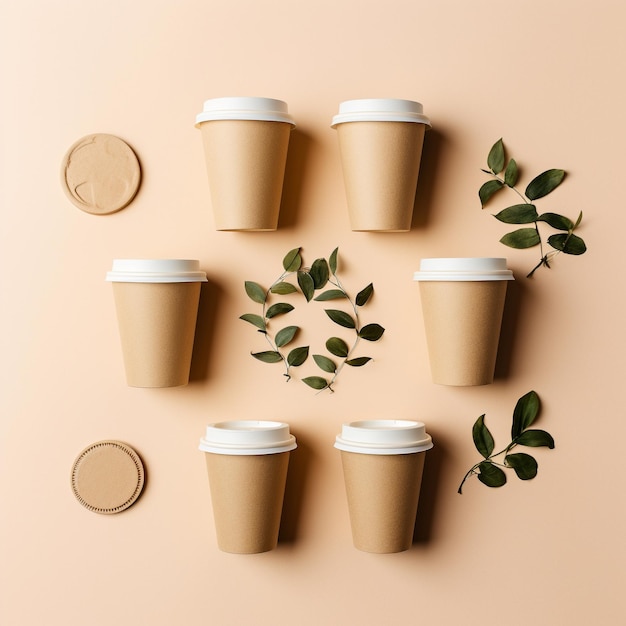
I want to click on cups in a circle, so click(162, 329), click(275, 462), click(381, 475), click(480, 335), click(377, 203), click(267, 197).